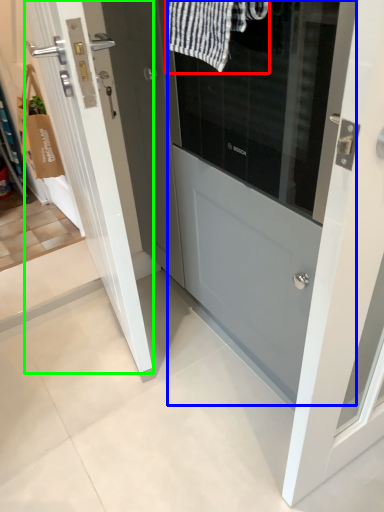
Question: Considering the real-world distances, which object is farthest from bath towel (highlighted by a red box)? door (highlighted by a blue box) or door (highlighted by a green box)?

Choices:
 (A) door
 (B) door

Answer: (B)